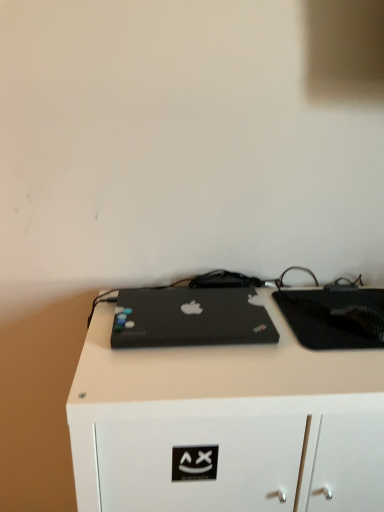
Locate an element on the screen. vacant space that is in between black matte laptop at center and black matte tablet at center is located at coordinates (271, 324).